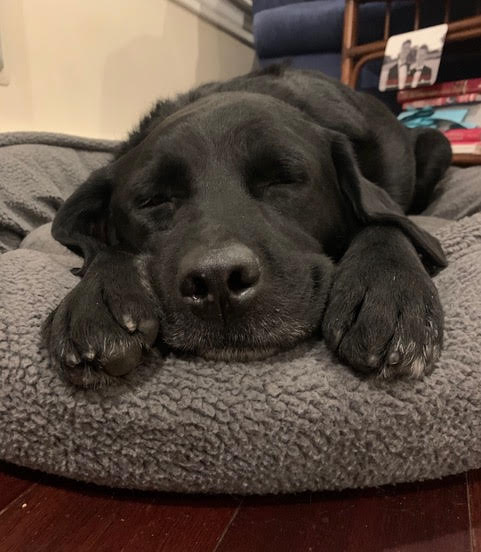
Find the location of a particular element. The image size is (481, 552). furniture is located at coordinates (305, 26).